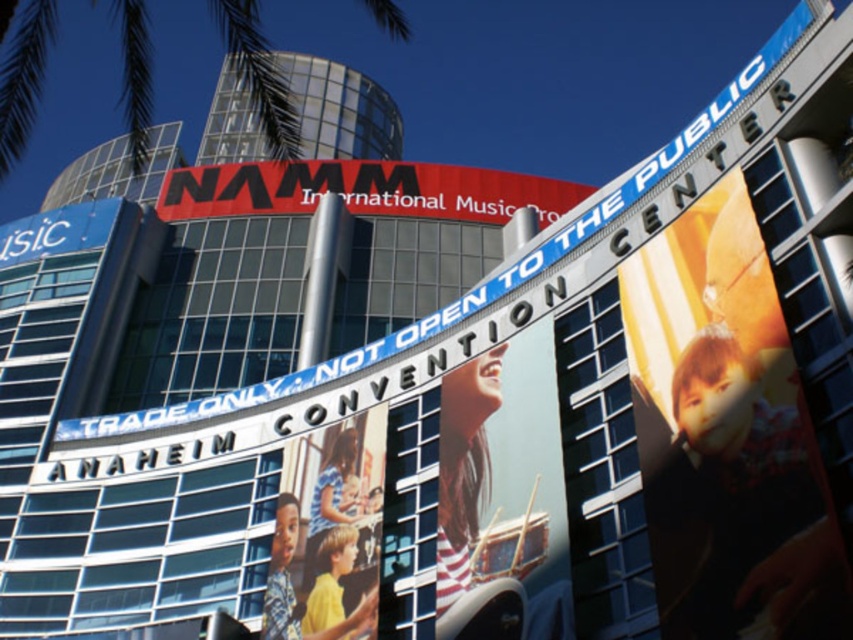
Question: Which object is farther from the camera taking this photo?

Choices:
 (A) matte black guitar at center
 (B) red matte sign at center
 (C) green leafy palm tree at upper left
 (D) matte plastic children at center

Answer: (B)

Question: Is matte plastic children at center below red matte sign at center?

Choices:
 (A) yes
 (B) no

Answer: (A)

Question: Which point appears closest to the camera in this image?

Choices:
 (A) (x=335, y=432)
 (B) (x=39, y=24)
 (C) (x=775, y=289)

Answer: (C)

Question: Which of these objects is positioned farthest from the matte black guitar at center?

Choices:
 (A) matte plastic children at center
 (B) green leafy palm tree at upper left

Answer: (B)

Question: Can you confirm if matte black child at right is positioned to the right of matte plastic children at center?

Choices:
 (A) yes
 (B) no

Answer: (A)

Question: Can you confirm if matte black child at right is positioned to the right of green leafy palm tree at upper left?

Choices:
 (A) yes
 (B) no

Answer: (A)